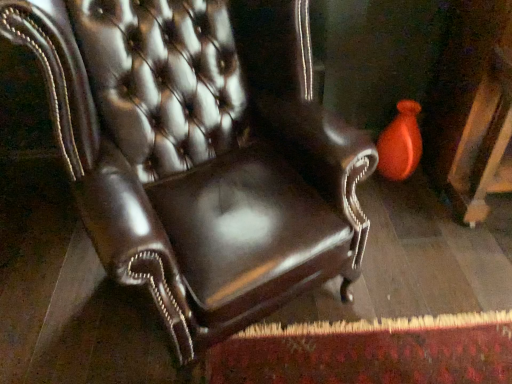
Locate an element on the screen. This screenshot has width=512, height=384. blank area to the left of shiny leather chair at center is located at coordinates (51, 289).